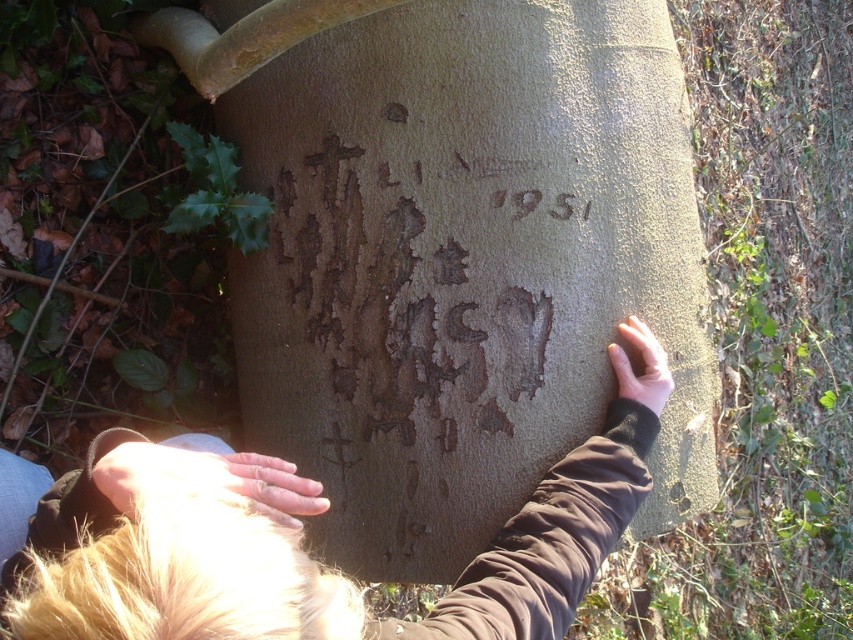
Who is shorter, brown leather jacket at center or smooth skin hand at center?

With less height is smooth skin hand at center.

Describe the element at coordinates (292, 547) in the screenshot. The image size is (853, 640). I see `brown leather jacket at center` at that location.

You are a GUI agent. You are given a task and a screenshot of the screen. Output one action in this format:
    pyautogui.click(x=<x>, y=<y>)
    Task: Click on the brown leather jacket at center
    The image size is (853, 640).
    Given the screenshot: What is the action you would take?
    pyautogui.click(x=292, y=547)

Is point (256, 509) positioned behind point (161, 464)?

No, (256, 509) is in front of (161, 464).

Is brown leather jacket at center bigger than smooth skin hand at lower left?

Indeed, brown leather jacket at center has a larger size compared to smooth skin hand at lower left.

Does point (231, 472) lie behind point (115, 500)?

Yes, it is behind point (115, 500).

In order to click on brown leather jacket at center in this screenshot , I will do `click(292, 547)`.

From the picture: Does smooth skin hand at lower left have a lesser width compared to smooth skin hand at center?

Incorrect, smooth skin hand at lower left's width is not less than smooth skin hand at center's.

Can you confirm if smooth skin hand at lower left is smaller than smooth skin hand at center?

Actually, smooth skin hand at lower left might be larger than smooth skin hand at center.

Describe the element at coordinates (206, 477) in the screenshot. I see `smooth skin hand at lower left` at that location.

Locate an element on the screen. smooth skin hand at lower left is located at coordinates (206, 477).